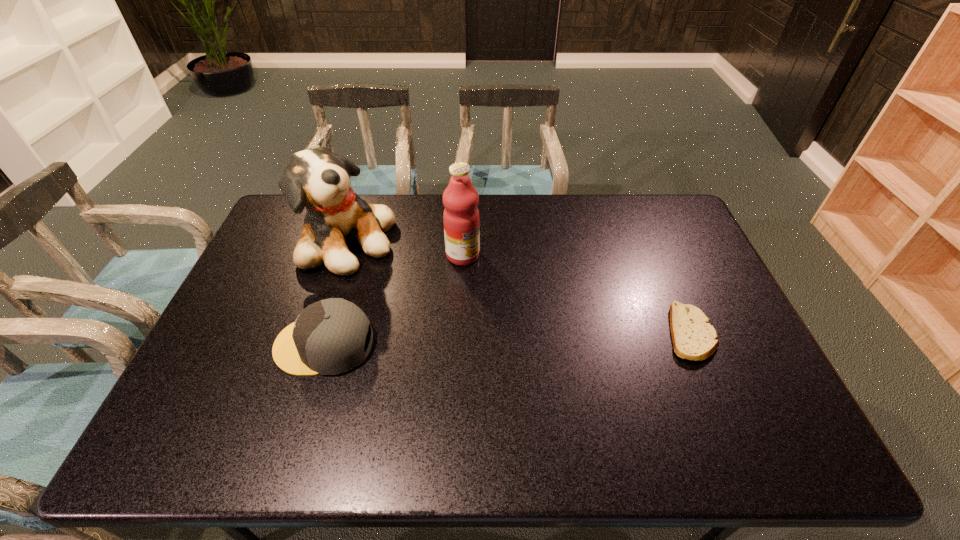
Where is `vacant space at the near edge`? The image size is (960, 540). vacant space at the near edge is located at coordinates (435, 394).

This screenshot has width=960, height=540. In the image, there is a desktop. Identify the location of vacant space at the left edge. (264, 240).

In the image, there is a desktop. Where is `vacant space at the right edge`? vacant space at the right edge is located at coordinates (743, 352).

Identify the location of free space at the near left corner of the desktop. The image size is (960, 540). (238, 413).

Where is `blank region between the puppy and the fruit juice`? blank region between the puppy and the fruit juice is located at coordinates (404, 249).

The image size is (960, 540). Identify the location of free space between the third object from left to right and the puppy. (404, 249).

This screenshot has height=540, width=960. What are the coordinates of `vacant area that lies between the rightmost object and the fruit juice` in the screenshot? It's located at (577, 294).

Locate an element on the screen. The height and width of the screenshot is (540, 960). free space between the fruit juice and the cap is located at coordinates (394, 300).

Locate an element on the screen. The height and width of the screenshot is (540, 960). unoccupied position between the shortest object and the third object from left to right is located at coordinates (577, 294).

Find the location of a particular element. Image resolution: width=960 pixels, height=540 pixels. empty location between the puppy and the second object from right to left is located at coordinates (404, 249).